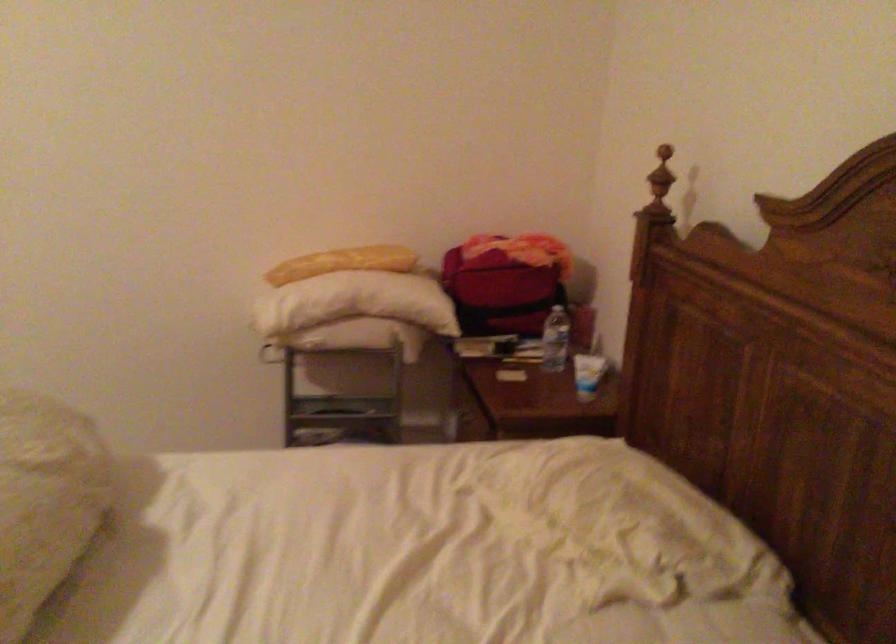
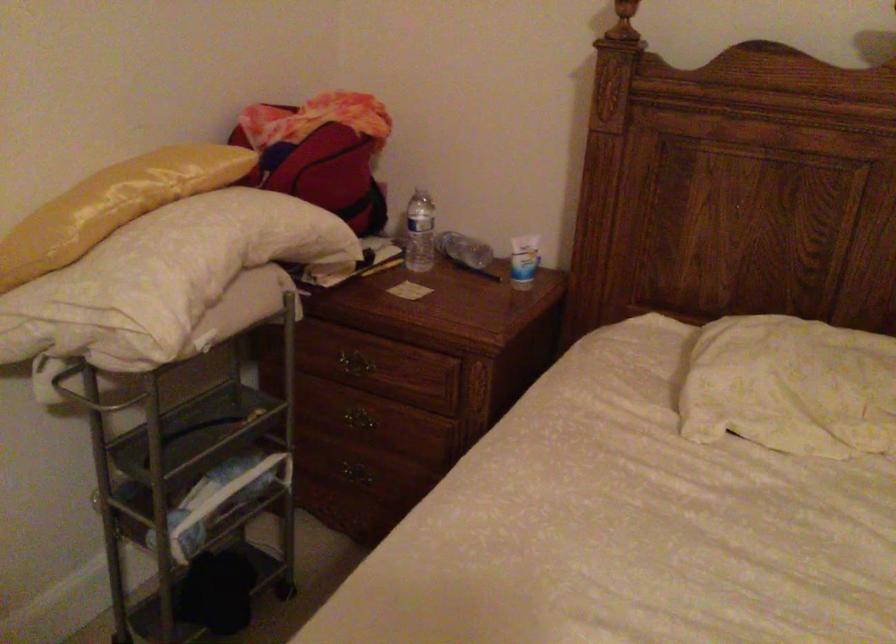
In the second image, find the point that corresponds to point 583,374 in the first image.

(523, 261)